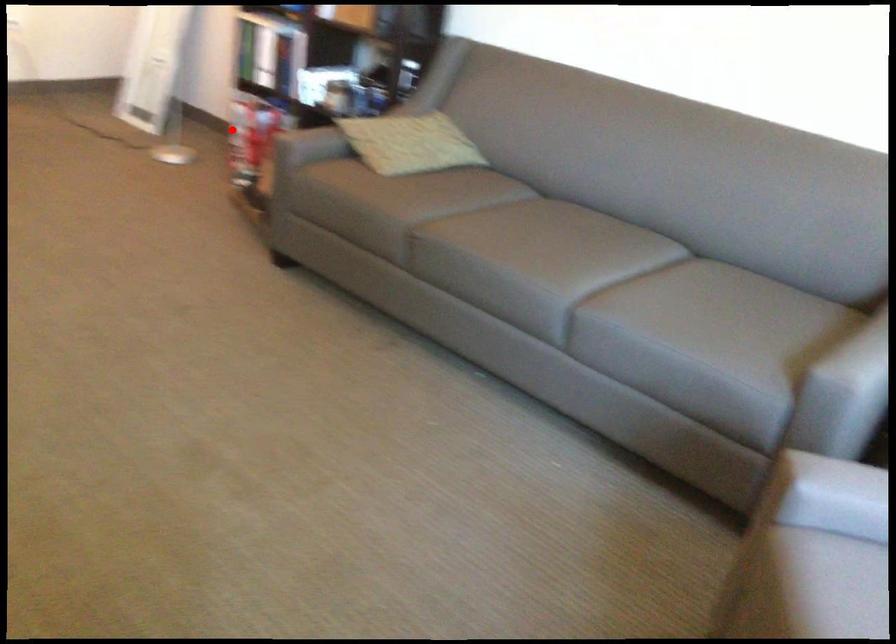
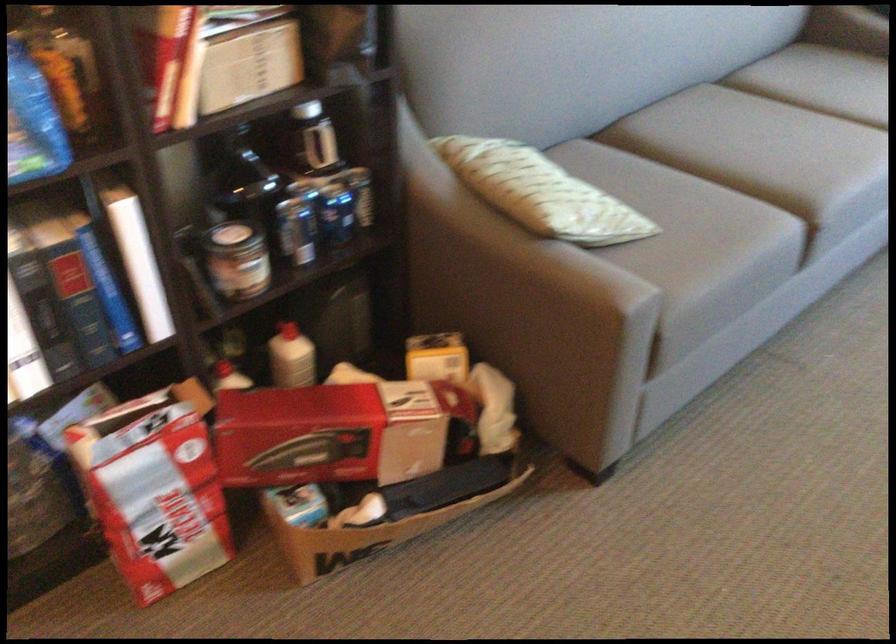
In the second image, find the point that corresponds to the highlighted location in the first image.

(297, 433)